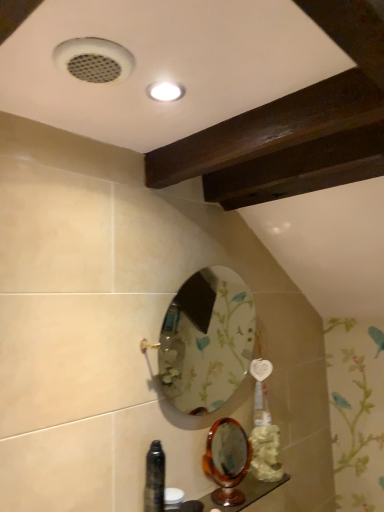
Question: Relative to floral-patterned glass mirror at center, which is counted as the 2th mirror, starting from the bottom, is wooden polished mirror at lower center, acting as the 2th mirror starting from the top, in front or behind?

Choices:
 (A) behind
 (B) front

Answer: (A)

Question: In terms of width, does wooden polished mirror at lower center, acting as the 2th mirror starting from the top, look wider or thinner when compared to floral-patterned glass mirror at center, the 1th mirror positioned from the top?

Choices:
 (A) thin
 (B) wide

Answer: (A)

Question: Based on their relative distances, which object is farther from the wooden polished mirror at lower center, placed as the first mirror when sorted from bottom to top?

Choices:
 (A) wooden polished counter top at lower center
 (B) floral-patterned glass mirror at center, which is counted as the 2th mirror, starting from the bottom
 (C) black glossy bottle at lower left

Answer: (B)

Question: Which of these objects is positioned closest to the black glossy bottle at lower left?

Choices:
 (A) floral-patterned glass mirror at center, which is counted as the 2th mirror, starting from the bottom
 (B) wooden polished counter top at lower center
 (C) wooden polished mirror at lower center, acting as the 2th mirror starting from the top

Answer: (C)